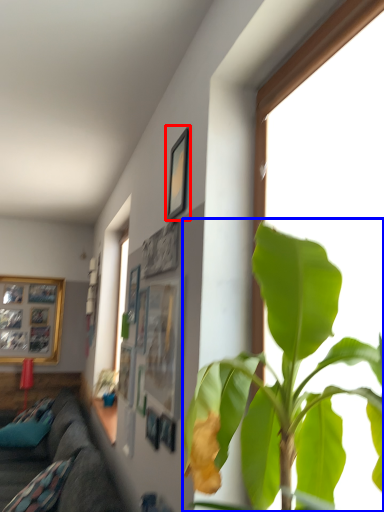
Question: Which point is further to the camera, picture frame (highlighted by a red box) or houseplant (highlighted by a blue box)?

Choices:
 (A) picture frame
 (B) houseplant

Answer: (A)